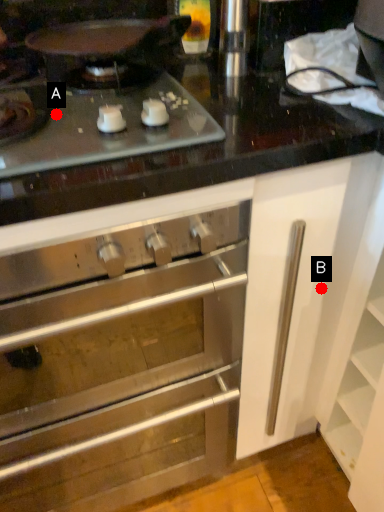
Question: Two points are circled on the image, labeled by A and B beside each circle. Among these points, which one is nearest to the camera?

Choices:
 (A) A is closer
 (B) B is closer

Answer: (A)